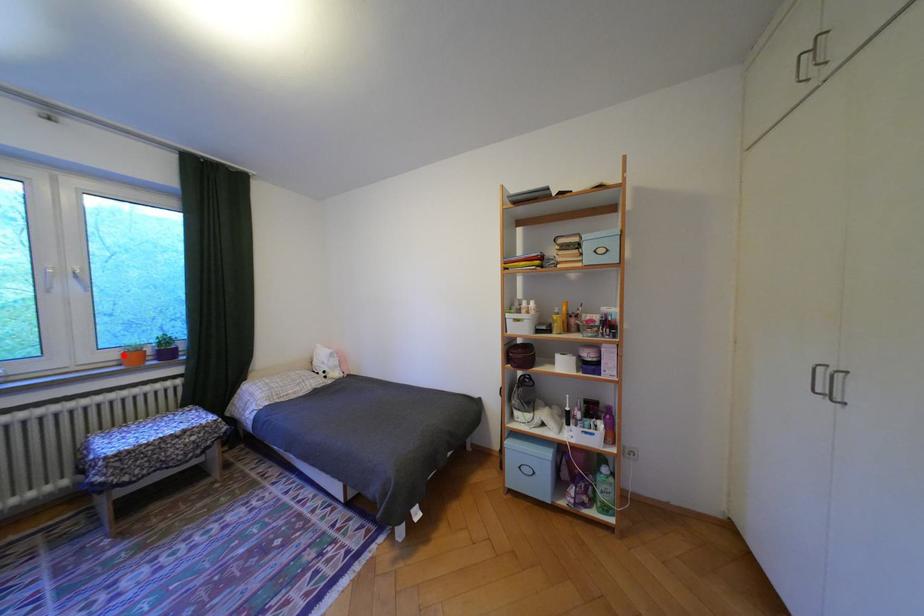
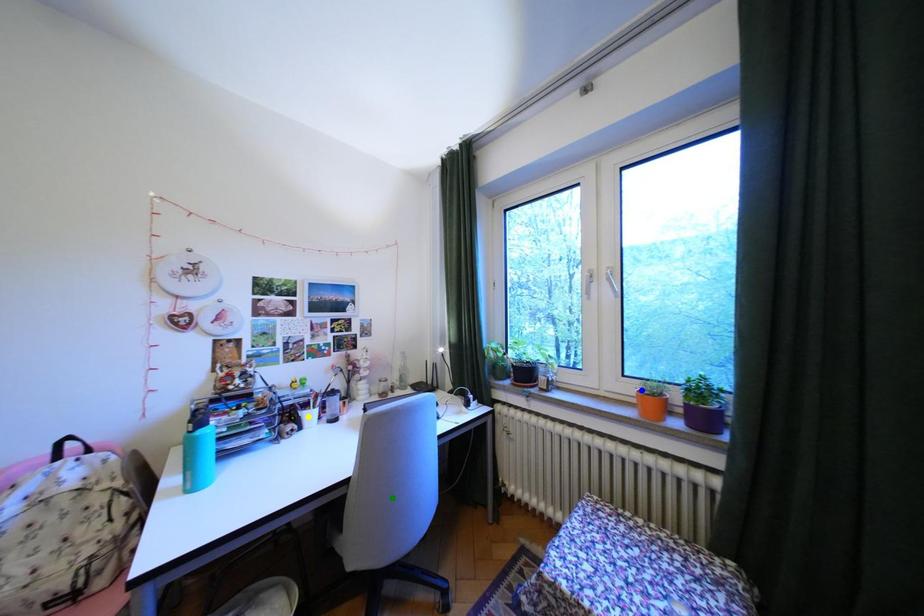
Question: I am providing you with two images of the same scene from different viewpoints. A red point is marked on the first image. You are given multiple points on the second image. Which mark in image 2 goes with the point in image 1?

Choices:
 (A) blue point
 (B) green point
 (C) yellow point

Answer: (A)